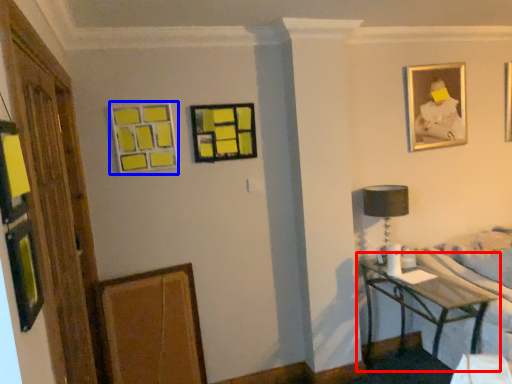
Question: Which object appears closest to the camera in this image, table (highlighted by a red box) or picture frame (highlighted by a blue box)?

Choices:
 (A) table
 (B) picture frame

Answer: (A)